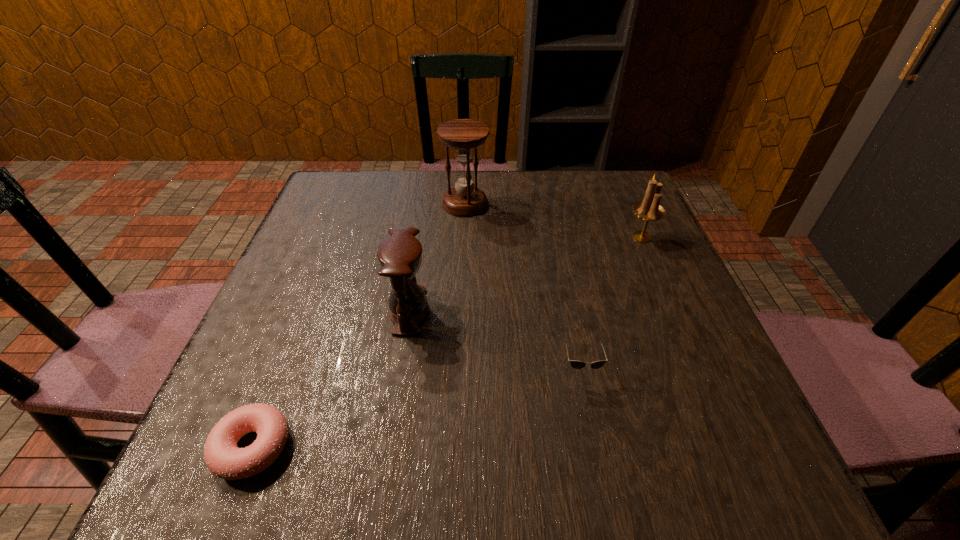
In order to click on blank area located 0.180m on the left of the taller hourglass in this screenshot , I will do `click(372, 204)`.

You are a GUI agent. You are given a task and a screenshot of the screen. Output one action in this format:
    pyautogui.click(x=<x>, y=<y>)
    Task: Click on the vacant space situated on the front of the second farthest object
    The width and height of the screenshot is (960, 540).
    Given the screenshot: What is the action you would take?
    pyautogui.click(x=692, y=353)

Locate an element on the screen. This screenshot has height=540, width=960. vacant space located on the back of the third farthest object is located at coordinates (424, 213).

You are a GUI agent. You are given a task and a screenshot of the screen. Output one action in this format:
    pyautogui.click(x=<x>, y=<y>)
    Task: Click on the vacant space positioned in front of the lenses of the second nearest object
    
    Given the screenshot: What is the action you would take?
    pyautogui.click(x=602, y=475)

At what (x,y) coordinates should I click in order to perform the action: click on vacant area located on the right of the doughnut. Please return your answer as a coordinate pair (x, y). The image size is (960, 540). Looking at the image, I should click on (371, 447).

The image size is (960, 540). I want to click on object that is at the far edge, so click(x=463, y=135).

Where is `object that is at the near edge`? This screenshot has width=960, height=540. object that is at the near edge is located at coordinates (225, 460).

Identify the location of object present at the left edge. (225, 460).

Locate an element on the screen. object that is positioned at the right edge is located at coordinates (650, 210).

Locate an element on the screen. This screenshot has width=960, height=540. object that is at the near left corner is located at coordinates (225, 460).